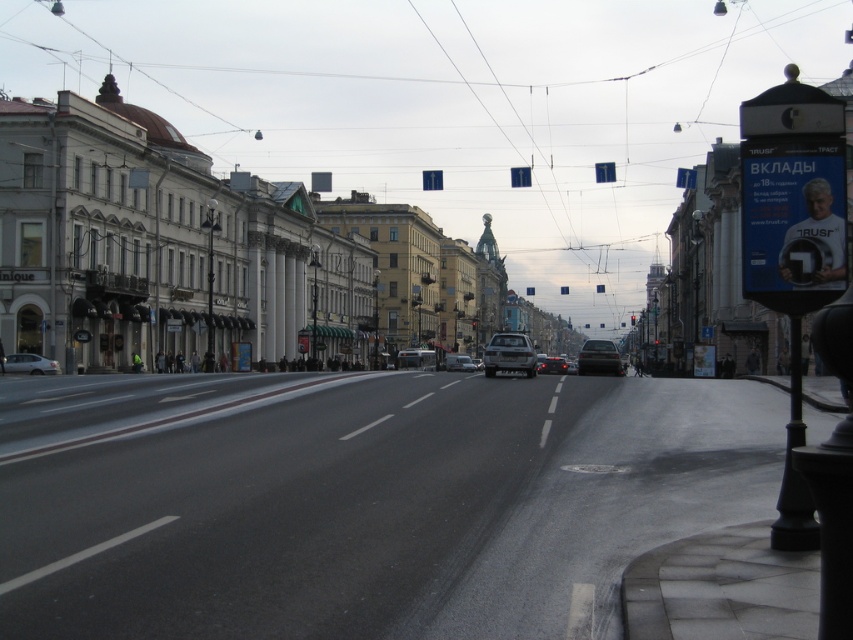
Question: Can you confirm if silver metallic suv at center is bigger than matte silver van at center?

Choices:
 (A) yes
 (B) no

Answer: (A)

Question: Which point is closer to the camera?

Choices:
 (A) (4, 355)
 (B) (514, 333)
 (C) (601, 348)
 (D) (548, 369)

Answer: (B)

Question: Can you confirm if metallic silver car at center is smaller than dark gray metallic car at center?

Choices:
 (A) yes
 (B) no

Answer: (A)

Question: Which point is farther to the camera?

Choices:
 (A) (491, 355)
 (B) (550, 360)
 (C) (582, 365)
 (D) (456, 355)

Answer: (D)

Question: Which object appears closest to the camera in this image?

Choices:
 (A) metallic silver car at center
 (B) silver metallic car at left
 (C) shiny black sedan at center

Answer: (A)

Question: Can you confirm if silver metallic car at left is wider than shiny black sedan at center?

Choices:
 (A) no
 (B) yes

Answer: (A)